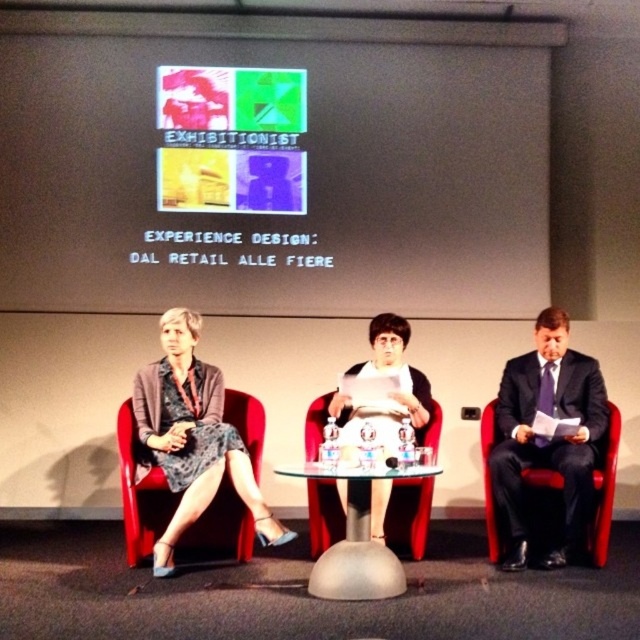
Question: Considering the relative positions of transparent glass table at center and red leather chair at right in the image provided, where is transparent glass table at center located with respect to red leather chair at right?

Choices:
 (A) right
 (B) left

Answer: (B)

Question: Does white matte projection screen at upper center have a larger size compared to matte fabric chair at left?

Choices:
 (A) yes
 (B) no

Answer: (A)

Question: Among these points, which one is nearest to the camera?

Choices:
 (A) (195, 534)
 (B) (496, 525)

Answer: (B)

Question: Can you confirm if matte fabric chair at left is thinner than red leather chair at right?

Choices:
 (A) no
 (B) yes

Answer: (A)

Question: Which of the following is the farthest from the observer?

Choices:
 (A) white matte projection screen at upper center
 (B) matte fabric chair at left
 (C) red leather chair at right

Answer: (A)

Question: Among these objects, which one is farthest from the camera?

Choices:
 (A) red leather chair at right
 (B) matte fabric chair at left

Answer: (B)